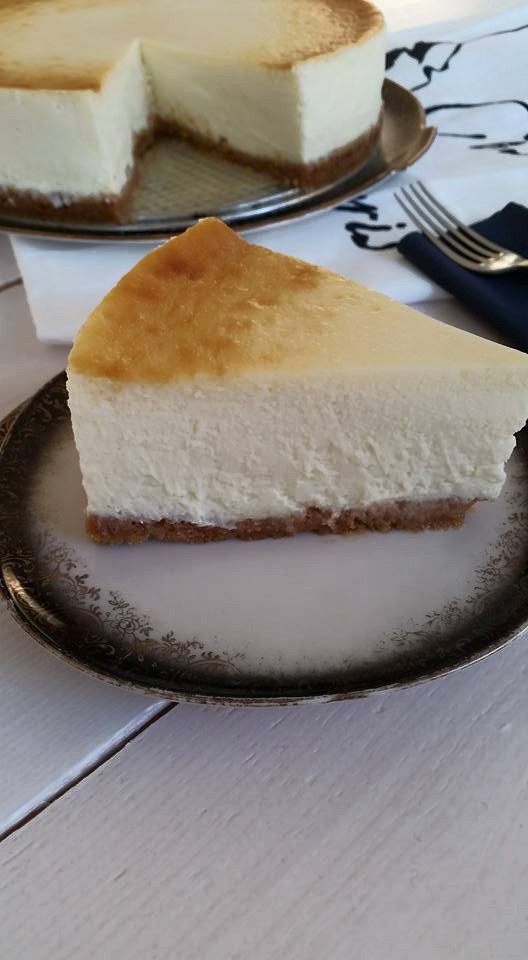
Locate an element on the screen. This screenshot has width=528, height=960. plate is located at coordinates (231, 175), (329, 627).